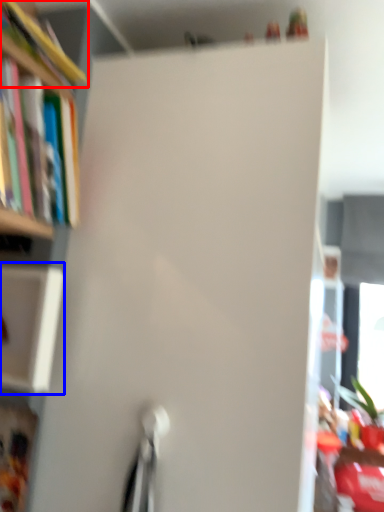
Question: Among these objects, which one is farthest to the camera, book (highlighted by a red box) or cabinet (highlighted by a blue box)?

Choices:
 (A) book
 (B) cabinet

Answer: (B)